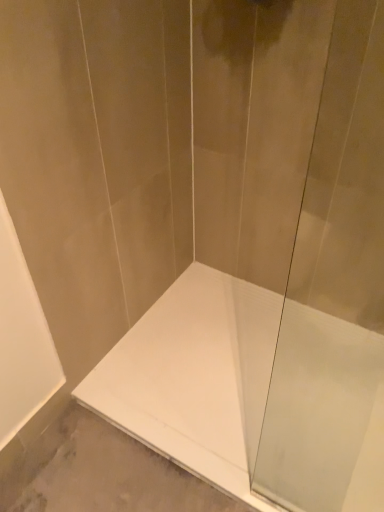
The width and height of the screenshot is (384, 512). In order to click on vacant area that is situated to the right of transparent glass shower door at center in this screenshot , I will do `click(351, 484)`.